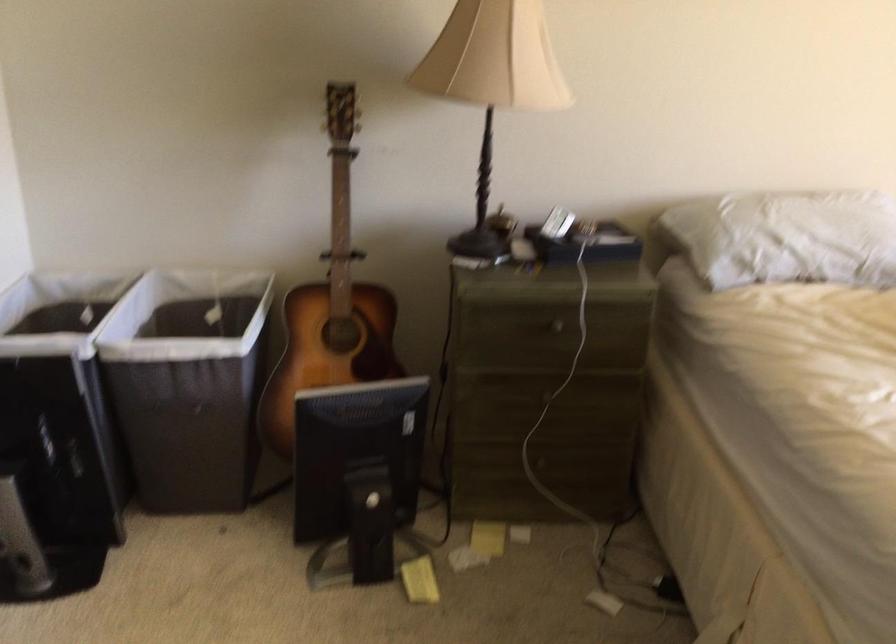
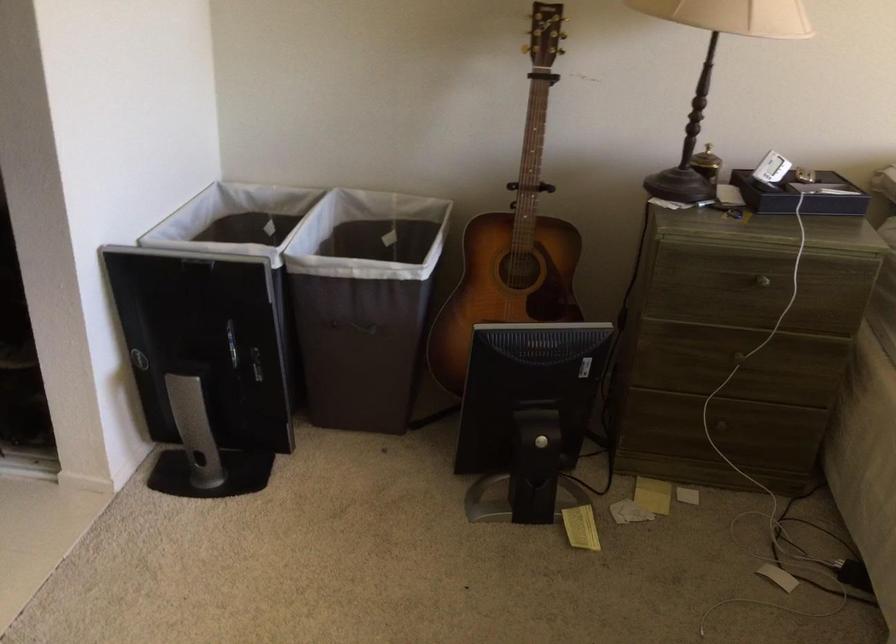
Where in the second image is the point corresponding to the point at 540,462 from the first image?

(718, 427)